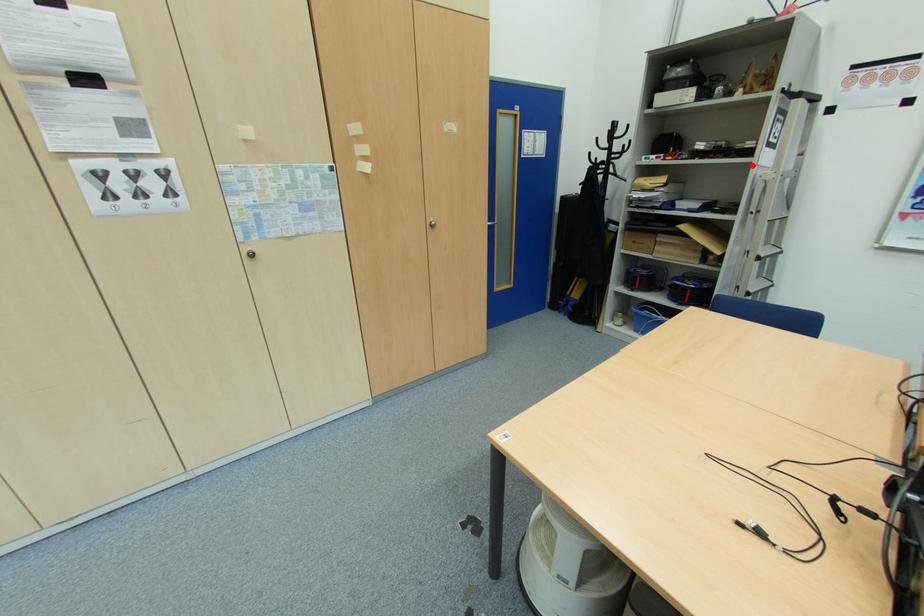
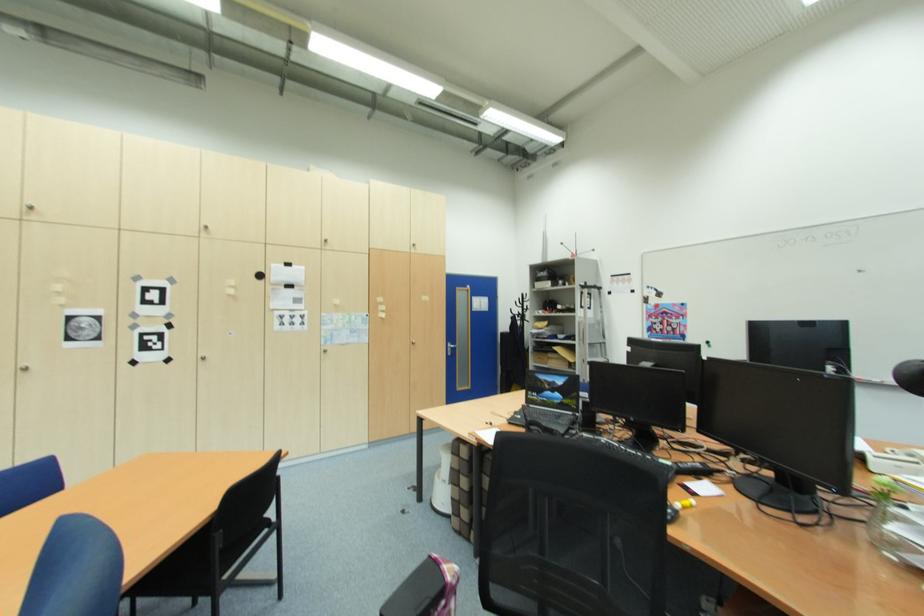
In the second image, find the point that corresponds to the highlighted location in the first image.

(578, 317)